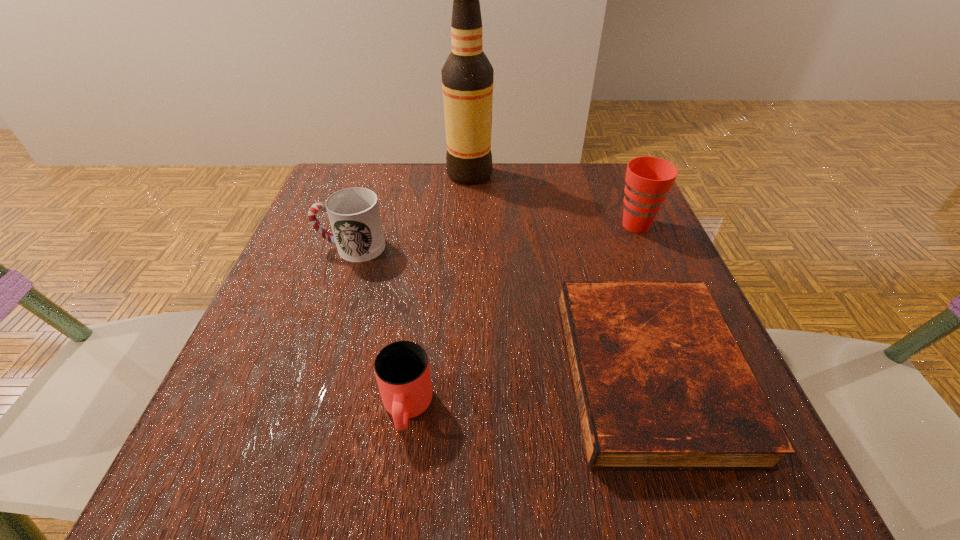
The height and width of the screenshot is (540, 960). Identify the location of vacant space located on the back of the tallest cup. (611, 166).

Identify the location of vacant space located 0.140m on the spine side of the Bible. (479, 373).

The image size is (960, 540). I want to click on free space located 0.130m on the spine side of the Bible, so click(x=486, y=373).

Identify the location of vacant space located on the spine side of the Bible. This screenshot has width=960, height=540. (532, 373).

At what (x,y) coordinates should I click in order to perform the action: click on alcohol positioned at the far edge. Please return your answer as a coordinate pair (x, y). This screenshot has width=960, height=540. Looking at the image, I should click on (467, 76).

The height and width of the screenshot is (540, 960). What are the coordinates of `cup present at the far edge` in the screenshot? It's located at (648, 179).

You are a GUI agent. You are given a task and a screenshot of the screen. Output one action in this format:
    pyautogui.click(x=<x>, y=<y>)
    Task: Click on the cup at the near edge
    The height and width of the screenshot is (540, 960).
    Given the screenshot: What is the action you would take?
    pyautogui.click(x=402, y=370)

I want to click on Bible at the near edge, so click(661, 385).

Find the location of a particular element. This screenshot has width=960, height=540. object that is at the left edge is located at coordinates (354, 215).

Where is `cup present at the right edge`? cup present at the right edge is located at coordinates (x=648, y=179).